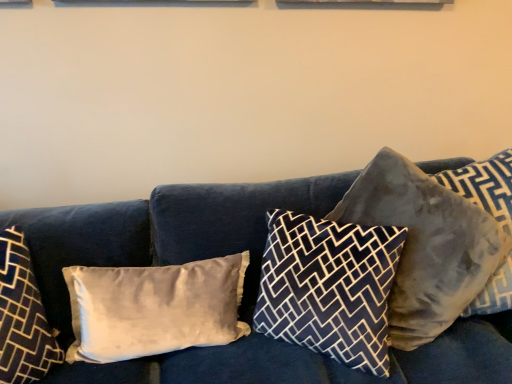
Question: Considering the relative positions of satin beige pillow at left, which is the 2th pillow from left to right, and dark blue patterned pillow at center, which is the 3th pillow in left-to-right order, in the image provided, is satin beige pillow at left, which is the 2th pillow from left to right, to the left of dark blue patterned pillow at center, which is the 3th pillow in left-to-right order, from the viewer's perspective?

Choices:
 (A) yes
 (B) no

Answer: (A)

Question: Is satin beige pillow at left, which appears as the 4th pillow when viewed from the right, in contact with dark blue patterned pillow at center, which is the 3th pillow from right to left?

Choices:
 (A) yes
 (B) no

Answer: (B)

Question: Is satin beige pillow at left, which appears as the 4th pillow when viewed from the right, bigger than dark blue patterned pillow at center, which is the 3th pillow from right to left?

Choices:
 (A) no
 (B) yes

Answer: (A)

Question: From a real-world perspective, is satin beige pillow at left, which is the 2th pillow from left to right, positioned over dark blue patterned pillow at center, which is the 3th pillow from right to left, based on gravity?

Choices:
 (A) no
 (B) yes

Answer: (A)

Question: Is satin beige pillow at left, which is the 2th pillow from left to right, smaller than dark blue patterned pillow at center, which is the 3th pillow from right to left?

Choices:
 (A) yes
 (B) no

Answer: (A)

Question: Considering the relative positions of satin beige pillow at left, which is the 2th pillow from left to right, and velvet blue couch at center in the image provided, is satin beige pillow at left, which is the 2th pillow from left to right, to the left or to the right of velvet blue couch at center?

Choices:
 (A) right
 (B) left

Answer: (B)

Question: In the image, is satin beige pillow at left, which appears as the 4th pillow when viewed from the right, positioned in front of or behind velvet blue couch at center?

Choices:
 (A) behind
 (B) front

Answer: (A)

Question: Is point (211, 319) positioned closer to the camera than point (340, 369)?

Choices:
 (A) farther
 (B) closer

Answer: (A)

Question: From the image's perspective, is satin beige pillow at left, which is the 2th pillow from left to right, located above or below velvet blue couch at center?

Choices:
 (A) below
 (B) above

Answer: (B)

Question: Considering the positions of satin beige pillow at left, which is the 2th pillow from left to right, and velvety gray pillow at right, acting as the first pillow starting from the right, in the image, is satin beige pillow at left, which is the 2th pillow from left to right, bigger or smaller than velvety gray pillow at right, acting as the first pillow starting from the right,?

Choices:
 (A) big
 (B) small

Answer: (B)

Question: Considering the positions of satin beige pillow at left, which is the 2th pillow from left to right, and velvety gray pillow at right, the fifth pillow from the left, in the image, is satin beige pillow at left, which is the 2th pillow from left to right, taller or shorter than velvety gray pillow at right, the fifth pillow from the left,?

Choices:
 (A) tall
 (B) short

Answer: (B)

Question: Relative to velvety gray pillow at right, acting as the first pillow starting from the right, is satin beige pillow at left, which is the 2th pillow from left to right, in front or behind?

Choices:
 (A) behind
 (B) front

Answer: (A)

Question: Is satin beige pillow at left, which is the 2th pillow from left to right, inside or outside of velvety gray pillow at right, acting as the first pillow starting from the right?

Choices:
 (A) outside
 (B) inside

Answer: (A)

Question: Considering the positions of point (x=215, y=334) and point (x=407, y=173), is point (x=215, y=334) closer or farther from the camera than point (x=407, y=173)?

Choices:
 (A) closer
 (B) farther

Answer: (A)

Question: From the image's perspective, is satin beige pillow at left, which is the 2th pillow from left to right, located above or below velvet gray pillow at right, arranged as the second pillow when viewed from the right?

Choices:
 (A) above
 (B) below

Answer: (B)